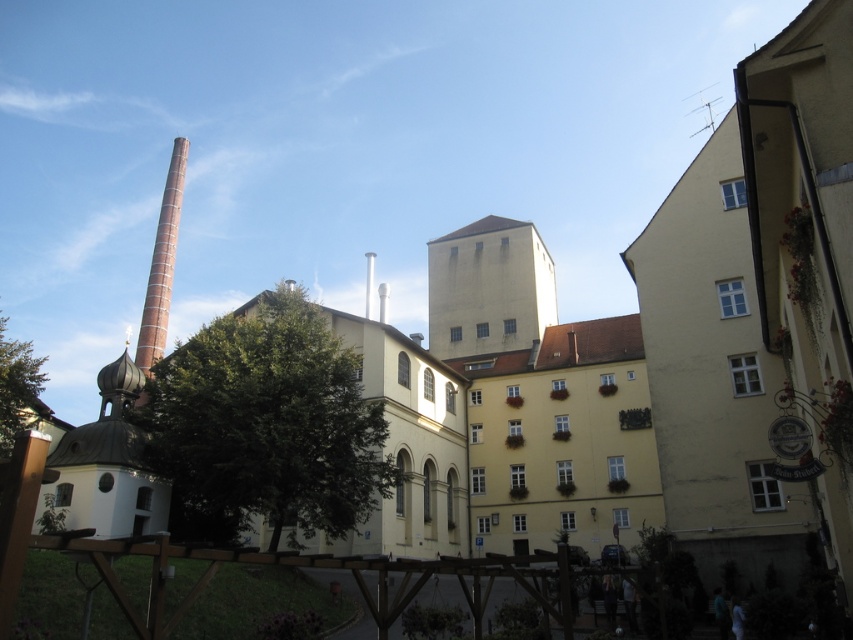
Question: Which point appears closest to the camera in this image?

Choices:
 (A) (22, 362)
 (B) (157, 320)
 (C) (386, 474)

Answer: (C)

Question: Considering the relative positions of brick textured chimney at left and green leafy tree at lower left in the image provided, where is brick textured chimney at left located with respect to green leafy tree at lower left?

Choices:
 (A) right
 (B) left

Answer: (A)

Question: Which of the following is the closest to the observer?

Choices:
 (A) green leafy tree at lower left
 (B) beige concrete tower at center
 (C) green leafy tree at center
 (D) brick textured chimney at left

Answer: (C)

Question: In this image, where is brick textured chimney at left located relative to green leafy tree at lower left?

Choices:
 (A) above
 (B) below

Answer: (A)

Question: Considering the relative positions of green leafy tree at center and brick textured chimney at left in the image provided, where is green leafy tree at center located with respect to brick textured chimney at left?

Choices:
 (A) left
 (B) right

Answer: (B)

Question: Which of the following is the closest to the observer?

Choices:
 (A) brick textured chimney at left
 (B) beige concrete tower at center

Answer: (B)